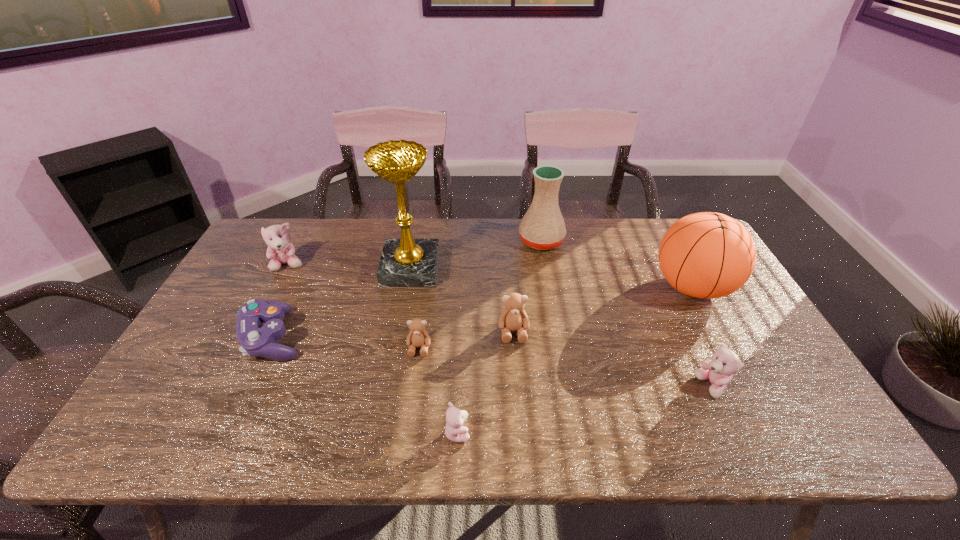
Find the location of a particular element. The height and width of the screenshot is (540, 960). empty space that is in between the second pink teddy bear from right to left and the pottery is located at coordinates (499, 336).

You are a GUI agent. You are given a task and a screenshot of the screen. Output one action in this format:
    pyautogui.click(x=<x>, y=<y>)
    Task: Click on the empty location between the award and the pottery
    
    Given the screenshot: What is the action you would take?
    pyautogui.click(x=476, y=255)

Where is `empty space that is in between the fourth farthest teddy bear and the purple control`? This screenshot has height=540, width=960. empty space that is in between the fourth farthest teddy bear and the purple control is located at coordinates [x=493, y=362].

You are a GUI agent. You are given a task and a screenshot of the screen. Output one action in this format:
    pyautogui.click(x=<x>, y=<y>)
    Task: Click on the empty space between the purple control and the farthest teddy bear
    
    Given the screenshot: What is the action you would take?
    pyautogui.click(x=281, y=301)

Image resolution: width=960 pixels, height=540 pixels. I want to click on empty space that is in between the gold award and the control, so click(x=343, y=303).

Locate an element on the screen. This screenshot has width=960, height=540. vacant space in between the basketball and the leftmost teddy bear is located at coordinates click(x=491, y=276).

Identify the location of empty location between the pottery and the control. This screenshot has height=540, width=960. (408, 289).

Find the location of a particular element. This screenshot has width=960, height=540. free space that is in between the nearest teddy bear and the pottery is located at coordinates (499, 336).

This screenshot has height=540, width=960. I want to click on free point between the fourth teddy bear from left to right and the nearest teddy bear, so click(486, 382).

Where is `object that is the fifth closest to the control`? object that is the fifth closest to the control is located at coordinates (513, 318).